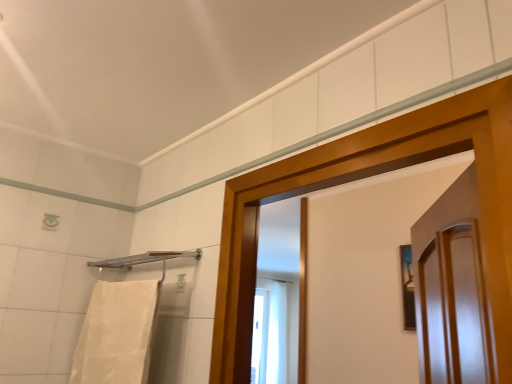
Question: From a real-world perspective, relative to silver metallic towel bar at upper left, is white cotton towel at left vertically above or below?

Choices:
 (A) below
 (B) above

Answer: (A)

Question: Would you say white cotton towel at left is inside or outside silver metallic towel bar at upper left?

Choices:
 (A) inside
 (B) outside

Answer: (B)

Question: In the image, is white cotton towel at left positioned in front of or behind silver metallic towel bar at upper left?

Choices:
 (A) behind
 (B) front

Answer: (B)

Question: Considering the positions of silver metallic towel bar at upper left and white cotton towel at left in the image, is silver metallic towel bar at upper left bigger or smaller than white cotton towel at left?

Choices:
 (A) big
 (B) small

Answer: (B)

Question: From their relative heights in the image, would you say silver metallic towel bar at upper left is taller or shorter than white cotton towel at left?

Choices:
 (A) tall
 (B) short

Answer: (B)

Question: Do you think silver metallic towel bar at upper left is within white cotton towel at left, or outside of it?

Choices:
 (A) inside
 (B) outside

Answer: (B)

Question: In terms of width, does silver metallic towel bar at upper left look wider or thinner when compared to white cotton towel at left?

Choices:
 (A) wide
 (B) thin

Answer: (A)